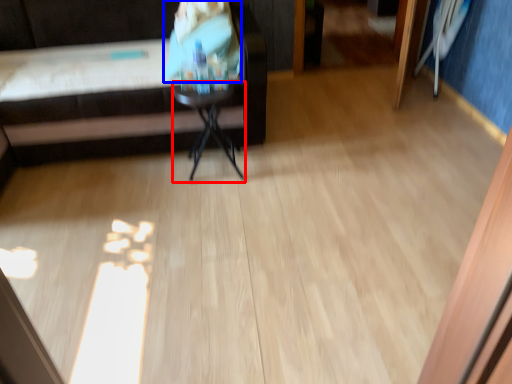
Question: Which of the following is the farthest to the observer, side table (highlighted by a red box) or person (highlighted by a blue box)?

Choices:
 (A) side table
 (B) person

Answer: (B)